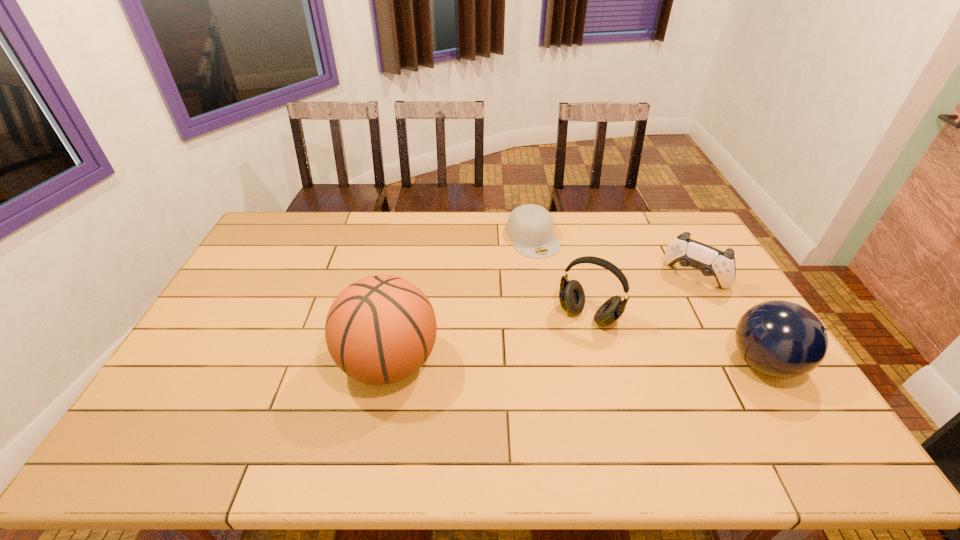
The width and height of the screenshot is (960, 540). Find the location of `vacant space situated on the front-facing side of the cap`. vacant space situated on the front-facing side of the cap is located at coordinates (564, 293).

The image size is (960, 540). I want to click on vacant area situated 0.240m on the front-facing side of the cap, so click(571, 303).

At what (x,y) coordinates should I click in order to perform the action: click on vacant region located on the front-facing side of the control. Please return your answer as a coordinate pair (x, y). The image size is (960, 540). Looking at the image, I should click on (639, 350).

At what (x,y) coordinates should I click in order to perform the action: click on free space located 0.200m on the front-facing side of the control. Please return your answer as a coordinate pair (x, y). Looking at the image, I should click on (657, 326).

Where is `vacant space located on the front-facing side of the control`? Image resolution: width=960 pixels, height=540 pixels. vacant space located on the front-facing side of the control is located at coordinates (662, 319).

Locate an element on the screen. The image size is (960, 540). free space located 0.080m on the ear cups of the headset is located at coordinates (565, 350).

You are a GUI agent. You are given a task and a screenshot of the screen. Output one action in this format:
    pyautogui.click(x=<x>, y=<y>)
    Task: Click on the vacant space located on the ear cups of the headset
    The image size is (960, 540).
    Given the screenshot: What is the action you would take?
    pyautogui.click(x=562, y=357)

What are the coordinates of `free location located 0.260m on the ear cups of the headset` in the screenshot? It's located at (538, 397).

You are a GUI agent. You are given a task and a screenshot of the screen. Output one action in this format:
    pyautogui.click(x=<x>, y=<y>)
    Task: Click on the object located at the far edge
    
    Given the screenshot: What is the action you would take?
    pyautogui.click(x=530, y=227)

You are a GUI agent. You are given a task and a screenshot of the screen. Output one action in this format:
    pyautogui.click(x=<x>, y=<y>)
    Task: Click on the basketball present at the near edge
    This screenshot has width=960, height=540.
    Given the screenshot: What is the action you would take?
    pyautogui.click(x=381, y=329)